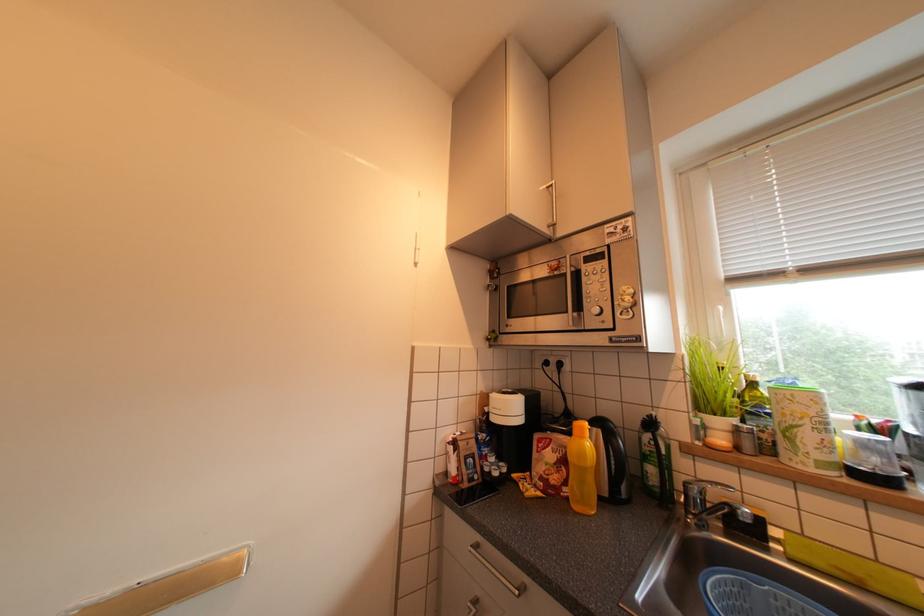
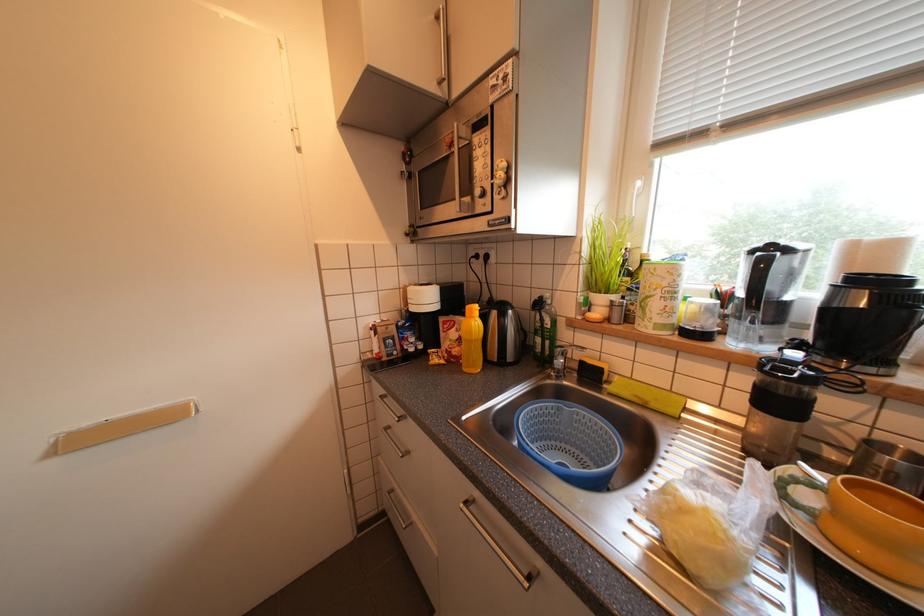
Question: How did the camera likely rotate?

Choices:
 (A) Left
 (B) Right
 (C) Up
 (D) Down

Answer: (D)